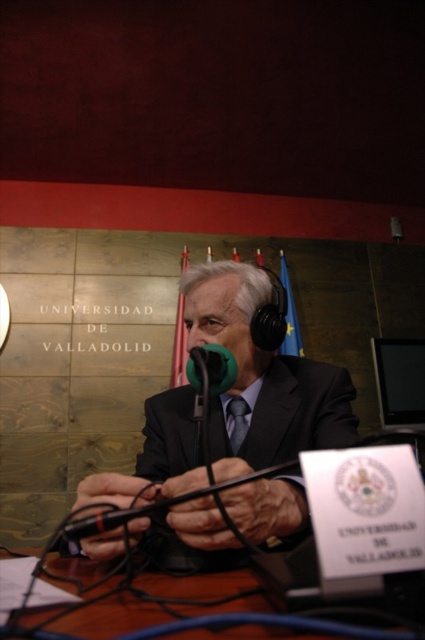
Question: Among these points, which one is farthest from the camera?

Choices:
 (A) (218, 330)
 (B) (241, 400)

Answer: (B)

Question: Considering the relative positions of wooden table at center and green matte microphone at center in the image provided, where is wooden table at center located with respect to green matte microphone at center?

Choices:
 (A) right
 (B) left

Answer: (B)

Question: Does matte black suit at center appear on the right side of green matte microphone at center?

Choices:
 (A) no
 (B) yes

Answer: (A)

Question: Among these points, which one is farthest from the camera?

Choices:
 (A) (241, 420)
 (B) (96, 620)
 (C) (181, 394)

Answer: (C)

Question: Can you confirm if wooden table at center is positioned below matte black tie at center?

Choices:
 (A) no
 (B) yes

Answer: (B)

Question: Which point is farther from the camera taking this photo?

Choices:
 (A) (195, 504)
 (B) (209, 634)
 (C) (197, 356)

Answer: (C)